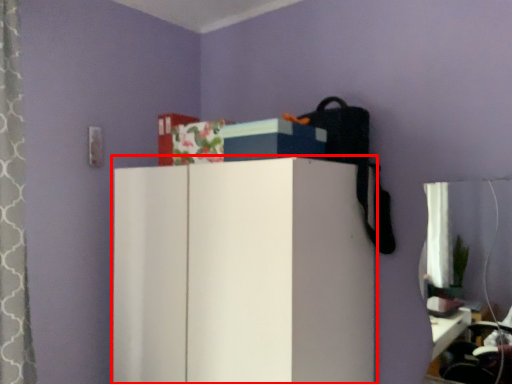
Question: From the image's perspective, what is the correct spatial relationship of furniture (annotated by the red box) in relation to storage box?

Choices:
 (A) below
 (B) above

Answer: (A)